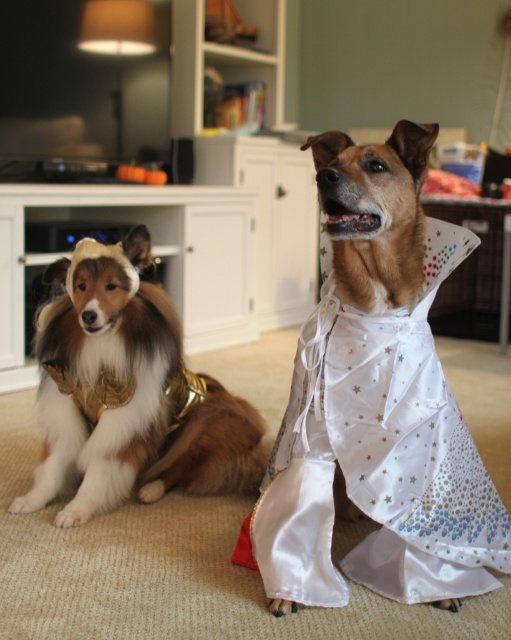
You are a photographer setting up for a pet photoshoot. You need to position the white satin dress at center and the golden fur dog at left so that both are visible in the frame. Considering their sizes, which object should be placed closer to the camera to ensure both are fully visible?

The golden fur dog at left should be placed closer to the camera because the white satin dress at center has a greater height. By positioning the taller dress farther back and the shorter dog closer, both will fit within the frame without one blocking the other.

You are organizing a Halloween costume party and need to place a decorative item on the white satin dress at center. According to the scene description, where exactly should you place it?

The white satin dress at center is located at point (379, 456), so you should place the decorative item at those coordinates.

You are planning to place a new decorative item in the living room. You have a small vase that is 30 cm wide. The white satin dress at center and the golden fur dog at left are already present. Which object can the vase fit next to without overlapping, considering their widths?

The white satin dress at center has a width less than the golden fur dog at left. Since the vase is 30 cm wide, it can fit next to either object, but it would have more space next to the golden fur dog at left because it is wider.